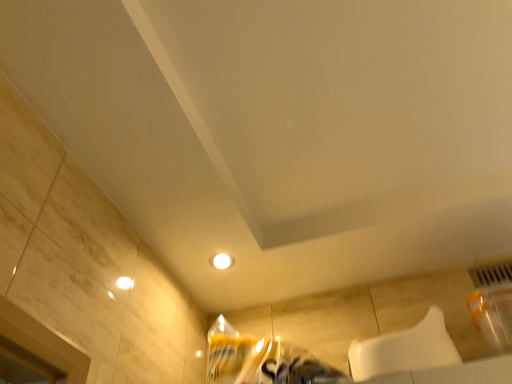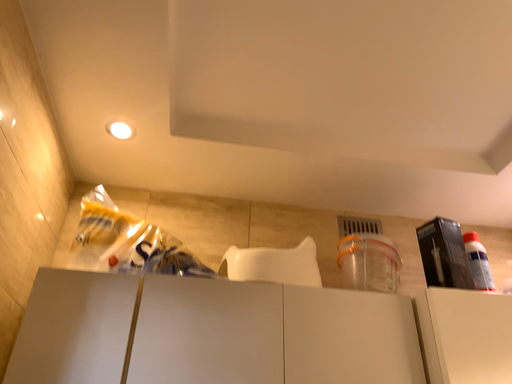
Question: Which way did the camera rotate in the video?

Choices:
 (A) rotated upward
 (B) rotated downward

Answer: (B)